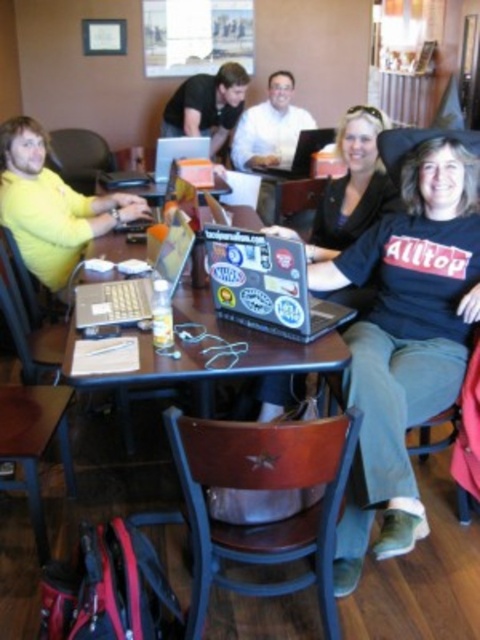
Who is more forward, (147, 214) or (264, 166)?

Point (147, 214) is in front.

Image resolution: width=480 pixels, height=640 pixels. What are the coordinates of `yellow matte shirt at left` in the screenshot? It's located at (51, 205).

Which is behind, point (206, 241) or point (181, 243)?

The point (181, 243) is behind.

Is sticker-covered laptop at center taller than matte black laptop at center?

No.

Is point (235, 253) behind point (166, 266)?

No, (235, 253) is in front of (166, 266).

Identify the location of sticker-covered laptop at center. This screenshot has height=640, width=480. (265, 284).

Can you confirm if sticker-covered laptop at center is shorter than shiny silver laptop at center?

No, sticker-covered laptop at center is not shorter than shiny silver laptop at center.

Is sticker-covered laptop at center positioned behind shiny silver laptop at center?

No, it is in front of shiny silver laptop at center.

Is point (236, 321) in front of point (334, 134)?

Yes, point (236, 321) is in front of point (334, 134).

The height and width of the screenshot is (640, 480). Find the location of `sticker-covered laptop at center`. sticker-covered laptop at center is located at coordinates (265, 284).